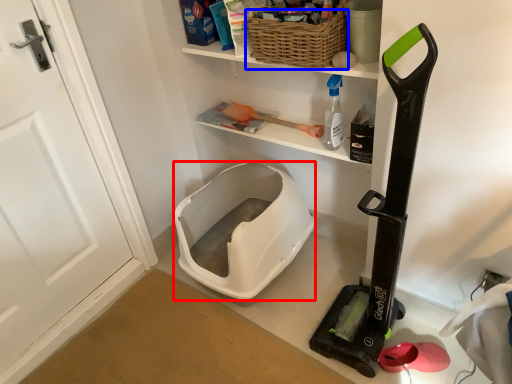
Question: Which object appears farthest to the camera in this image, wide (highlighted by a red box) or basket (highlighted by a blue box)?

Choices:
 (A) wide
 (B) basket

Answer: (A)